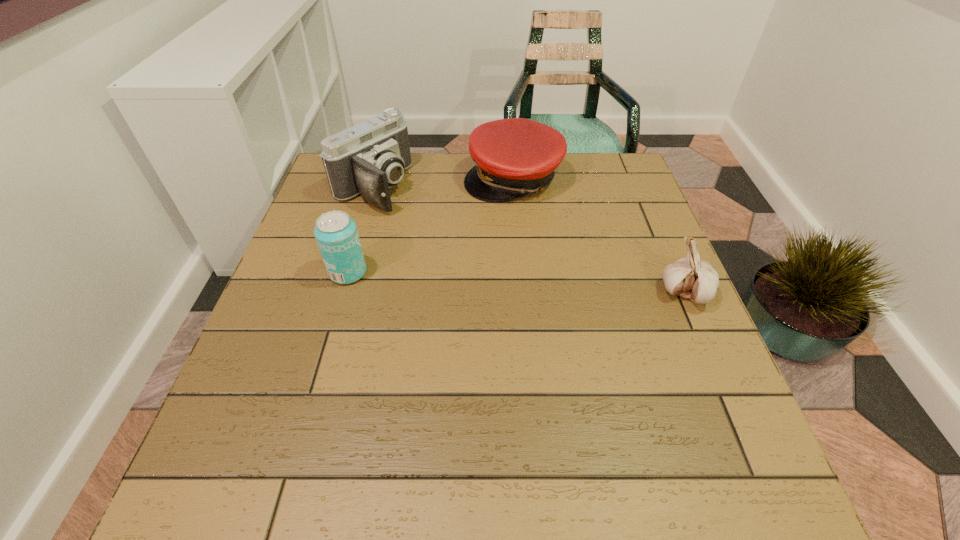
The height and width of the screenshot is (540, 960). I want to click on free spot on the desktop that is between the beer can and the garlic and is positioned at the front of the camera with an open lens cover, so click(526, 284).

This screenshot has width=960, height=540. I want to click on free spot on the desktop that is between the beer can and the garlic and is positioned at the front of the cap where the visor is located, so 475,280.